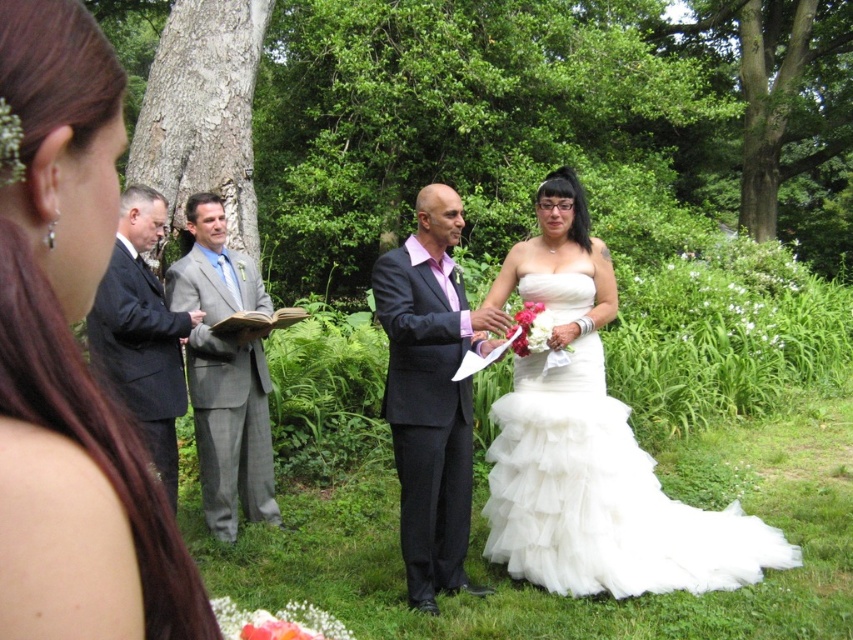
You are a photographer at a wedding ceremony. You need to adjust your camera focus to capture both the white satin dress at center and the matte black suit at center clearly. Which object should you focus on first to ensure proper depth of field?

The white satin dress at center is located above the matte black suit at center. To ensure proper depth of field, focus on the matte black suit at center first since it is closer to the camera, then adjust for the white satin dress at center.

Based on the photo, you are a photographer at the wedding ceremony. You need to position yourself so that the white satin dress at center is exactly in the center of your camera frame. Where should you aim your camera?

The white satin dress at center is located at point 0.566 on the horizontal axis and 0.086 on the vertical axis. To center it in your camera frame, aim your camera at those coordinates.